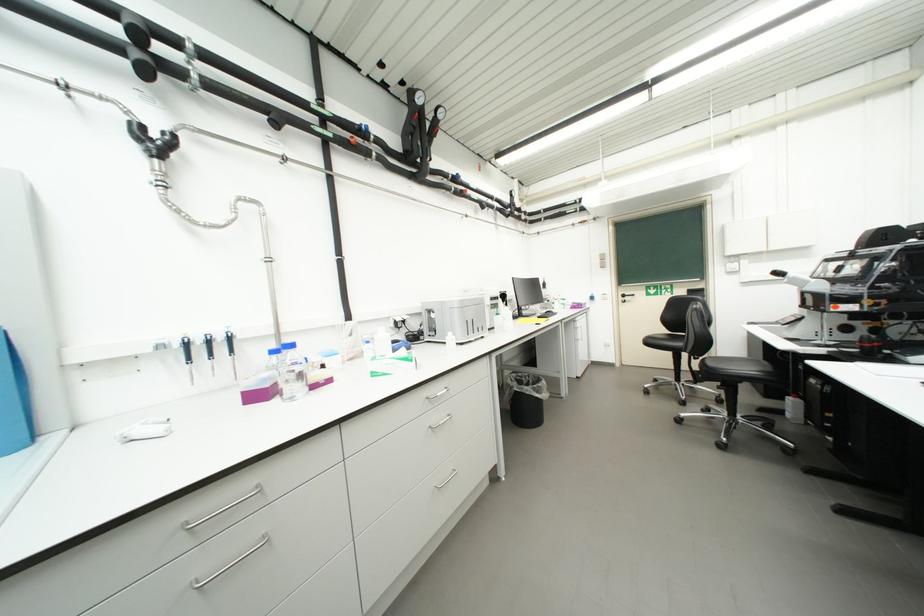
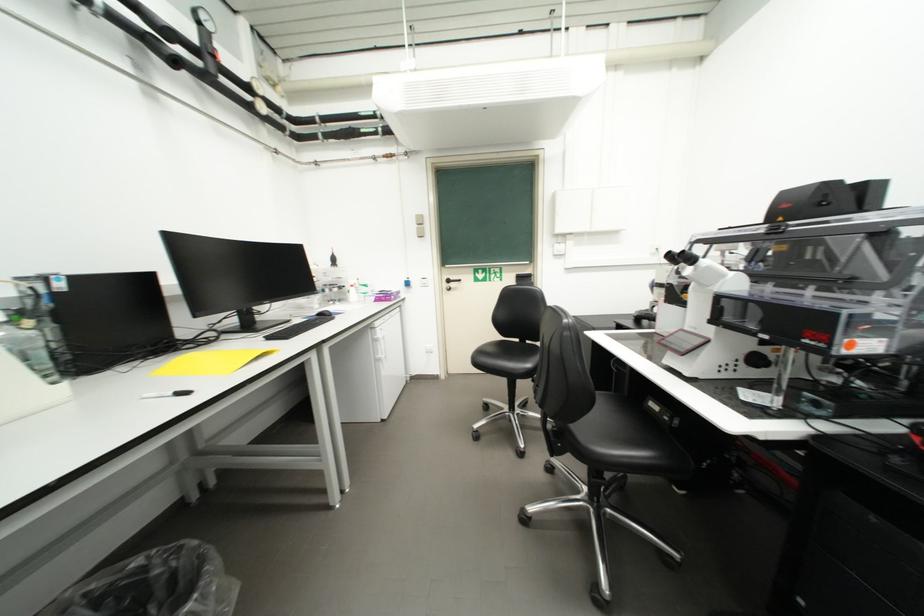
In the second image, find the point that corresponds to (x=631, y=297) in the first image.

(456, 283)